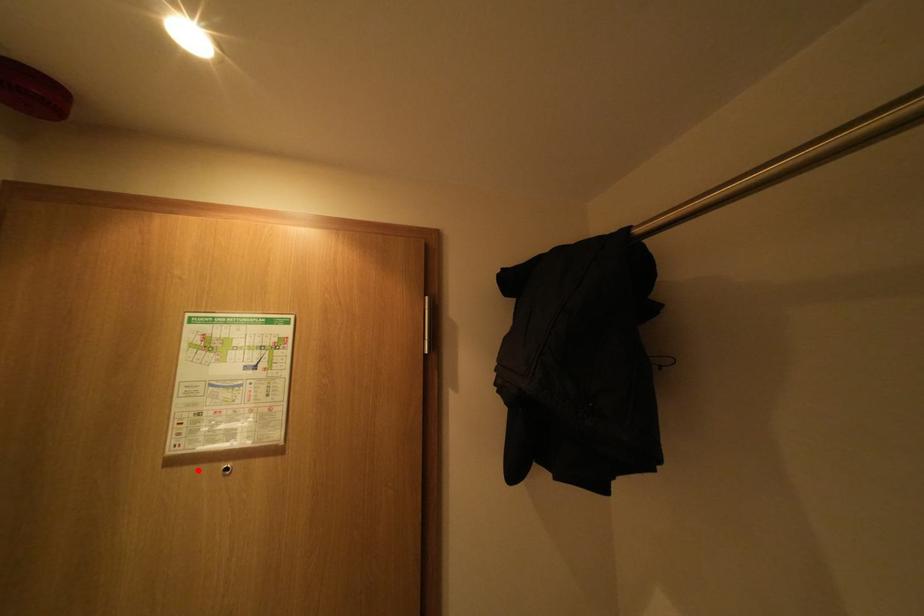
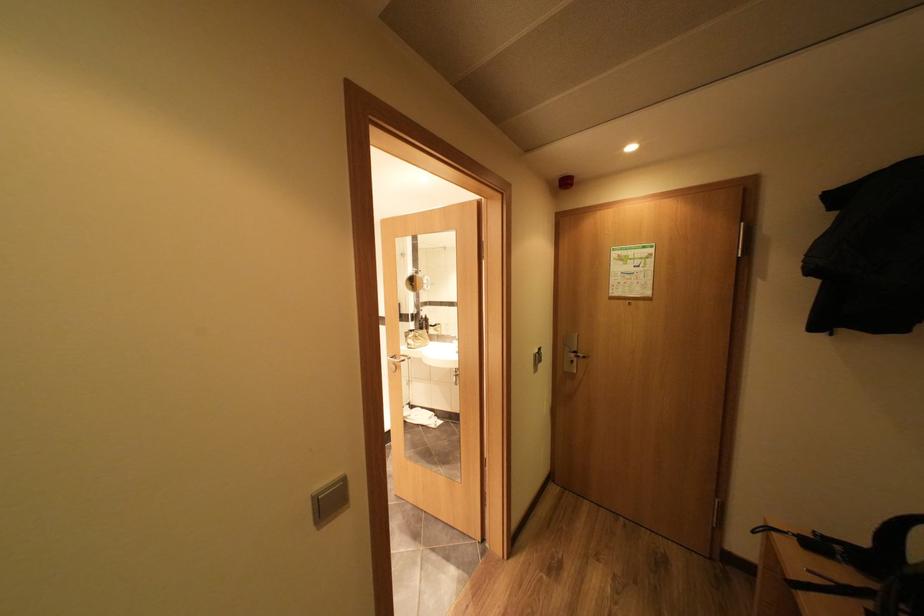
Find the pixel in the second image that matches the highlighted location in the first image.

(626, 302)